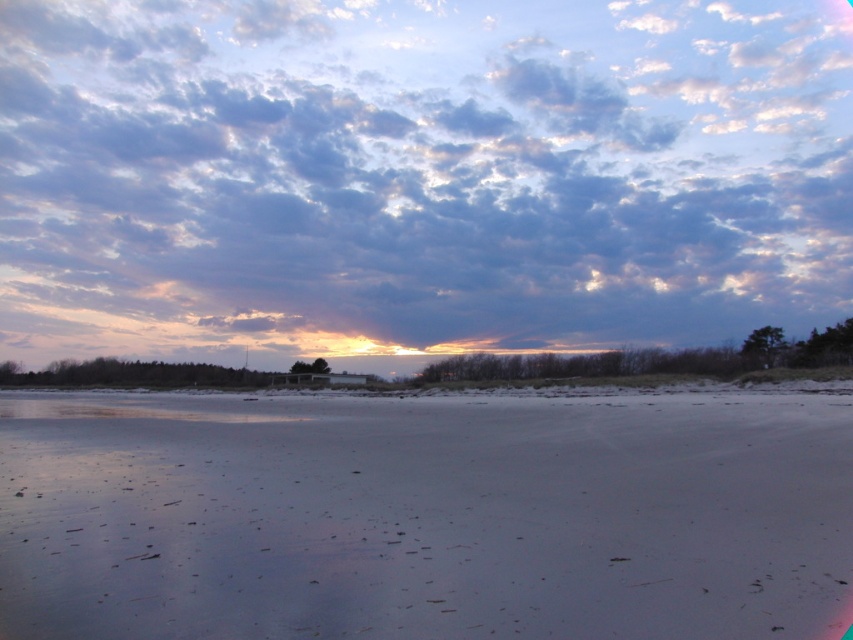
Question: Which of the following is the closest to the observer?

Choices:
 (A) (444, 480)
 (B) (111, 250)

Answer: (A)

Question: Which point appears farthest from the camera in this image?

Choices:
 (A) (222, 166)
 (B) (824, 404)

Answer: (A)

Question: Does cloudy sky at upper center have a larger size compared to white sandy beach at center?

Choices:
 (A) yes
 (B) no

Answer: (A)

Question: Which object is farther from the camera taking this photo?

Choices:
 (A) cloudy sky at upper center
 (B) white sandy beach at center

Answer: (A)

Question: Is cloudy sky at upper center below white sandy beach at center?

Choices:
 (A) no
 (B) yes

Answer: (A)

Question: Does cloudy sky at upper center have a larger size compared to white sandy beach at center?

Choices:
 (A) no
 (B) yes

Answer: (B)